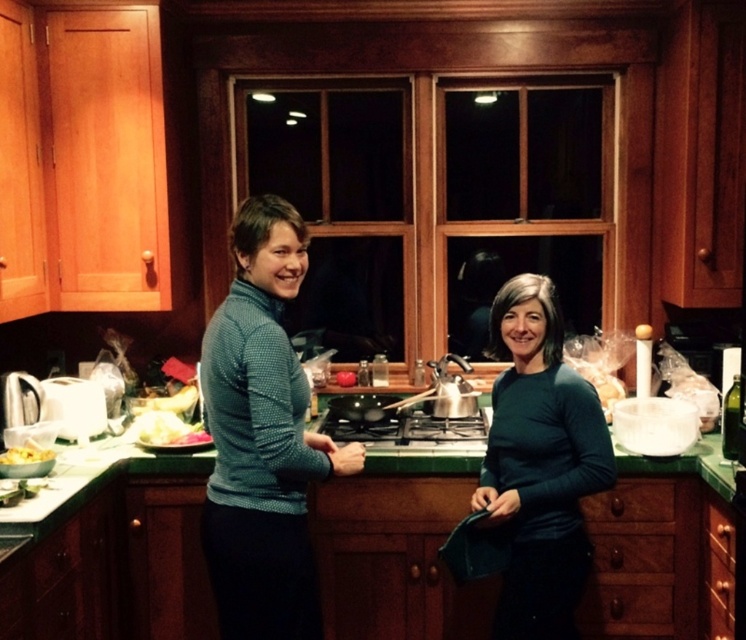
Which is below, blue dotted sweater at center or dark green sweater at center?

dark green sweater at center is lower down.

Which is behind, point (289, 368) or point (507, 324)?

Positioned behind is point (507, 324).

Describe the element at coordinates (263, 436) in the screenshot. I see `blue dotted sweater at center` at that location.

At what (x,y) coordinates should I click in order to perform the action: click on blue dotted sweater at center. Please return your answer as a coordinate pair (x, y). Looking at the image, I should click on (263, 436).

Can you confirm if blue dotted sweater at center is thinner than yellow matte pasta at lower left?

No.

Is point (351, 445) positioned after point (13, 460)?

That is False.

Between point (266, 513) and point (50, 452), which one is positioned in front?

Point (266, 513) is more forward.

Identify the location of blue dotted sweater at center. Image resolution: width=746 pixels, height=640 pixels. (263, 436).

Who is taller, teal dotted sweater at center or yellow matte pasta at lower left?

teal dotted sweater at center is taller.

The height and width of the screenshot is (640, 746). Identify the location of teal dotted sweater at center. (263, 436).

Does point (278, 403) come farther from viewer compared to point (22, 454)?

That is False.

I want to click on teal dotted sweater at center, so click(x=263, y=436).